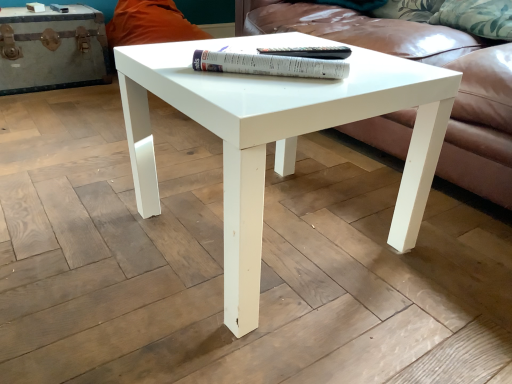
At what (x,y) coordinates should I click in order to perform the action: click on free spot to the right of white paper at center, which ranks as the 1th paperback book in front-to-back order. Please return your answer as a coordinate pair (x, y). The image size is (512, 384). Looking at the image, I should click on tap(387, 69).